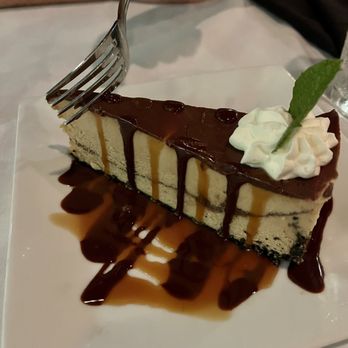
Image resolution: width=348 pixels, height=348 pixels. I want to click on table cloth, so click(x=227, y=43), click(x=36, y=43).